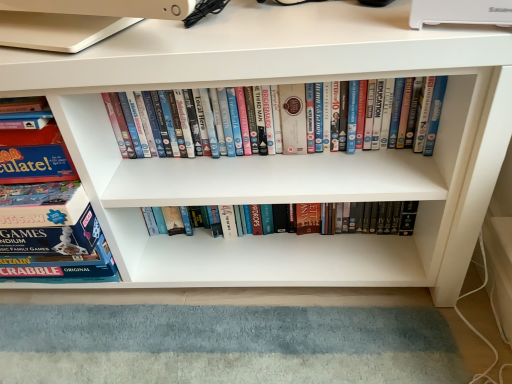
Question: Could you tell me if blue cardboard game box at left, the first book from the left, is turned towards white glossy dvds at center, marked as the first book in a right-to-left arrangement?

Choices:
 (A) yes
 (B) no

Answer: (B)

Question: Considering the relative sizes of blue cardboard game box at left, the first book from the left, and white glossy dvds at center, the 2th book positioned from the left, in the image provided, is blue cardboard game box at left, the first book from the left, taller than white glossy dvds at center, the 2th book positioned from the left,?

Choices:
 (A) no
 (B) yes

Answer: (B)

Question: Considering the relative positions of blue cardboard game box at left, the first book from the left, and white glossy dvds at center, marked as the first book in a right-to-left arrangement, in the image provided, is blue cardboard game box at left, the first book from the left, to the right of white glossy dvds at center, marked as the first book in a right-to-left arrangement, from the viewer's perspective?

Choices:
 (A) yes
 (B) no

Answer: (B)

Question: Can you confirm if blue cardboard game box at left, the first book from the left, is bigger than white glossy dvds at center, marked as the first book in a right-to-left arrangement?

Choices:
 (A) yes
 (B) no

Answer: (A)

Question: Can you confirm if blue cardboard game box at left, the first book from the left, is thinner than white glossy dvds at center, the 2th book positioned from the left?

Choices:
 (A) no
 (B) yes

Answer: (A)

Question: Is white glossy dvds at center, marked as the first book in a right-to-left arrangement, a part of blue cardboard game box at left, the first book from the left?

Choices:
 (A) yes
 (B) no

Answer: (B)

Question: Is white glossy dvds at center, the 2th book positioned from the left, thinner than blue cardboard game box at left, the first book from the left?

Choices:
 (A) yes
 (B) no

Answer: (A)

Question: Is white glossy dvds at center, marked as the first book in a right-to-left arrangement, positioned with its back to blue cardboard game box at left, the first book from the left?

Choices:
 (A) no
 (B) yes

Answer: (A)

Question: Does white glossy dvds at center, the 2th book positioned from the left, turn towards blue cardboard game box at left, the first book from the left?

Choices:
 (A) no
 (B) yes

Answer: (A)

Question: Is white glossy dvds at center, the 2th book positioned from the left, to the left of blue cardboard game box at left, the first book from the left, from the viewer's perspective?

Choices:
 (A) yes
 (B) no

Answer: (B)

Question: Considering the relative positions of white glossy dvds at center, the 2th book positioned from the left, and blue cardboard game box at left, the first book from the left, in the image provided, is white glossy dvds at center, the 2th book positioned from the left, in front of blue cardboard game box at left, the first book from the left,?

Choices:
 (A) no
 (B) yes

Answer: (A)

Question: Is white glossy dvds at center, the 2th book positioned from the left, located outside blue cardboard game box at left, which is the second book in right-to-left order?

Choices:
 (A) no
 (B) yes

Answer: (B)

Question: Is white glossy dvds at center, the 2th book positioned from the left, bigger or smaller than blue cardboard game box at left, which is the second book in right-to-left order?

Choices:
 (A) big
 (B) small

Answer: (B)